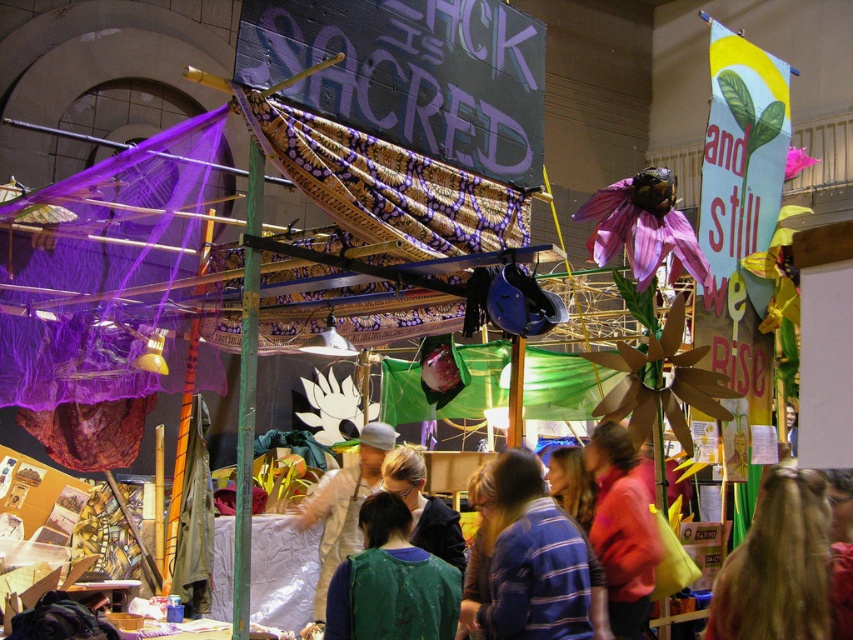
You are an artist trying to capture the scene accurately. You notice two elements at the center of your view. Which one is wider between the blonde hair at center and the pink fabric at center?

The blonde hair at center is wider than the pink fabric at center.

Consider the image. You are an artist trying to recreate the scene. You notice two elements at the center of the image. Which one is to the right of the other? The blonde hair at center or the pink fabric at center?

The blonde hair at center is positioned on the right side of pink fabric at center.

You are at an event and want to identify someone wearing a striped cotton shirt at center. Where would you look relative to the person with blonde hair at center?

The striped cotton shirt at center is located below the blonde hair at center, so you should look downward from the person with blonde hair at center to find the striped cotton shirt at center.